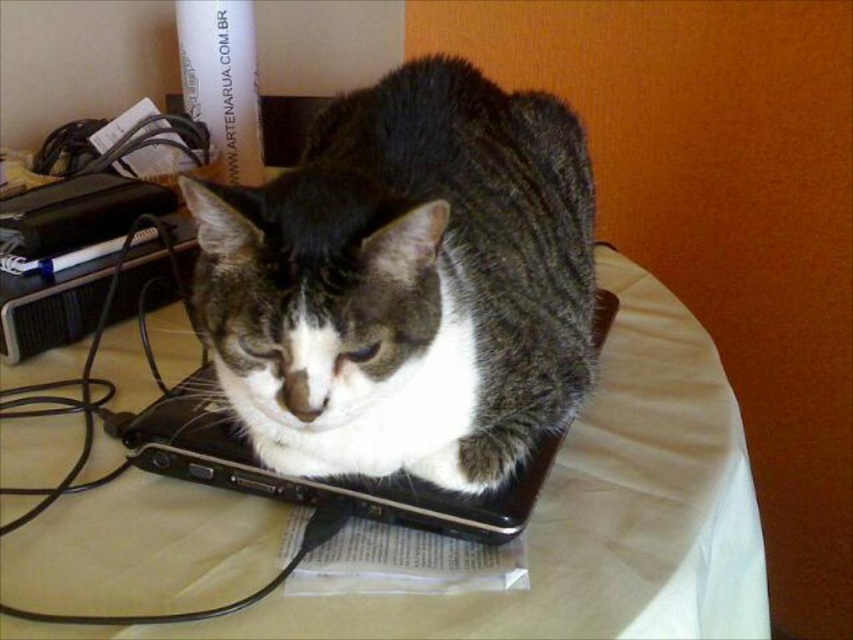
Is gray tabby cat at center smaller than beige fabric tablecloth at center?

Correct, gray tabby cat at center occupies less space than beige fabric tablecloth at center.

Which is behind, point (540, 124) or point (100, 586)?

Positioned behind is point (540, 124).

The width and height of the screenshot is (853, 640). Find the location of `gray tabby cat at center`. gray tabby cat at center is located at coordinates (405, 282).

Who is positioned more to the left, gray tabby cat at center or black plastic laptop at center?

gray tabby cat at center

Is gray tabby cat at center positioned in front of black plastic laptop at center?

Yes, it is.

Does point (489, 138) come farther from viewer compared to point (524, 518)?

Yes, point (489, 138) is farther from viewer.

Locate an element on the screen. The width and height of the screenshot is (853, 640). gray tabby cat at center is located at coordinates (405, 282).

Is beige fabric tablecloth at center bigger than black plastic laptop at center?

Yes.

Measure the distance from beige fabric tablecloth at center to black plastic laptop at center.

A distance of 2.96 inches exists between beige fabric tablecloth at center and black plastic laptop at center.

Is point (149, 384) positioned in front of point (235, 486)?

No.

Locate an element on the screen. Image resolution: width=853 pixels, height=640 pixels. beige fabric tablecloth at center is located at coordinates (589, 513).